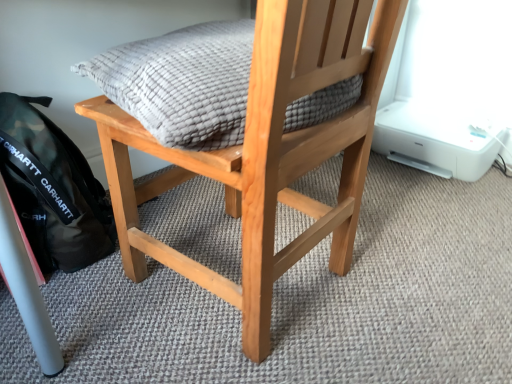
Question: Does textured gray cushion at center appear on the right side of black matte backpack at lower left?

Choices:
 (A) yes
 (B) no

Answer: (A)

Question: Considering the relative sizes of textured gray cushion at center and black matte backpack at lower left in the image provided, is textured gray cushion at center smaller than black matte backpack at lower left?

Choices:
 (A) no
 (B) yes

Answer: (A)

Question: Does textured gray cushion at center have a greater width compared to black matte backpack at lower left?

Choices:
 (A) yes
 (B) no

Answer: (A)

Question: Is textured gray cushion at center not near black matte backpack at lower left?

Choices:
 (A) no
 (B) yes

Answer: (A)

Question: Considering the relative positions of textured gray cushion at center and black matte backpack at lower left in the image provided, is textured gray cushion at center to the left of black matte backpack at lower left from the viewer's perspective?

Choices:
 (A) yes
 (B) no

Answer: (B)

Question: Is natural wood chair at center inside or outside of black matte backpack at lower left?

Choices:
 (A) outside
 (B) inside

Answer: (A)

Question: Considering their positions, is natural wood chair at center located in front of or behind black matte backpack at lower left?

Choices:
 (A) front
 (B) behind

Answer: (A)

Question: Considering the positions of natural wood chair at center and black matte backpack at lower left in the image, is natural wood chair at center wider or thinner than black matte backpack at lower left?

Choices:
 (A) thin
 (B) wide

Answer: (B)

Question: In terms of size, does natural wood chair at center appear bigger or smaller than black matte backpack at lower left?

Choices:
 (A) big
 (B) small

Answer: (A)

Question: Is natural wood chair at center taller or shorter than textured gray cushion at center?

Choices:
 (A) short
 (B) tall

Answer: (B)

Question: Is point pos(381,59) positioned closer to the camera than point pos(318,96)?

Choices:
 (A) farther
 (B) closer

Answer: (A)

Question: In terms of size, does natural wood chair at center appear bigger or smaller than textured gray cushion at center?

Choices:
 (A) big
 (B) small

Answer: (A)

Question: In the image, is natural wood chair at center positioned in front of or behind textured gray cushion at center?

Choices:
 (A) front
 (B) behind

Answer: (A)

Question: In the image, is black matte backpack at lower left positioned in front of or behind natural wood chair at center?

Choices:
 (A) behind
 (B) front

Answer: (A)

Question: From a real-world perspective, relative to natural wood chair at center, is black matte backpack at lower left vertically above or below?

Choices:
 (A) above
 (B) below

Answer: (B)